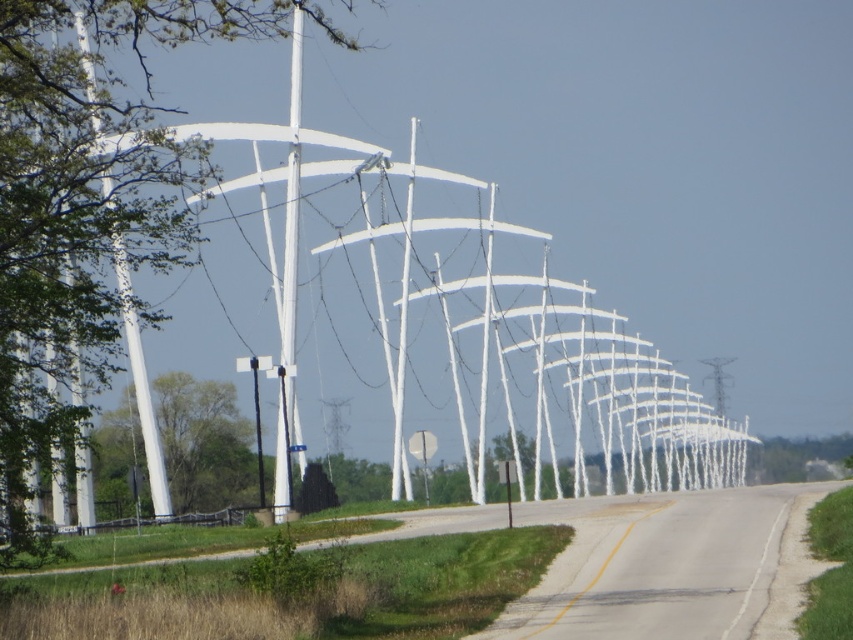
Can you confirm if green leafy tree at left is taller than white glossy pole at center?

Correct, green leafy tree at left is much taller as white glossy pole at center.

Based on the photo, is green leafy tree at left to the left of white glossy pole at center from the viewer's perspective?

Correct, you'll find green leafy tree at left to the left of white glossy pole at center.

Describe the element at coordinates (86, 209) in the screenshot. I see `green leafy tree at left` at that location.

Image resolution: width=853 pixels, height=640 pixels. Find the location of `green leafy tree at left`. green leafy tree at left is located at coordinates (86, 209).

Locate an element on the screen. green leafy tree at center is located at coordinates (204, 444).

Which is more to the right, green leafy tree at center or white glossy pole at center?

Positioned to the right is white glossy pole at center.

Image resolution: width=853 pixels, height=640 pixels. What are the coordinates of `green leafy tree at center` in the screenshot? It's located at (204, 444).

Which is above, white glossy pole at center or yellow painted line at center?

white glossy pole at center

Can you confirm if white glossy pole at center is shorter than yellow painted line at center?

Incorrect, white glossy pole at center's height does not fall short of yellow painted line at center's.

Does point (293, 346) come in front of point (631, 525)?

No, (293, 346) is further to viewer.

The image size is (853, 640). What are the coordinates of `white glossy pole at center` in the screenshot? It's located at (291, 195).